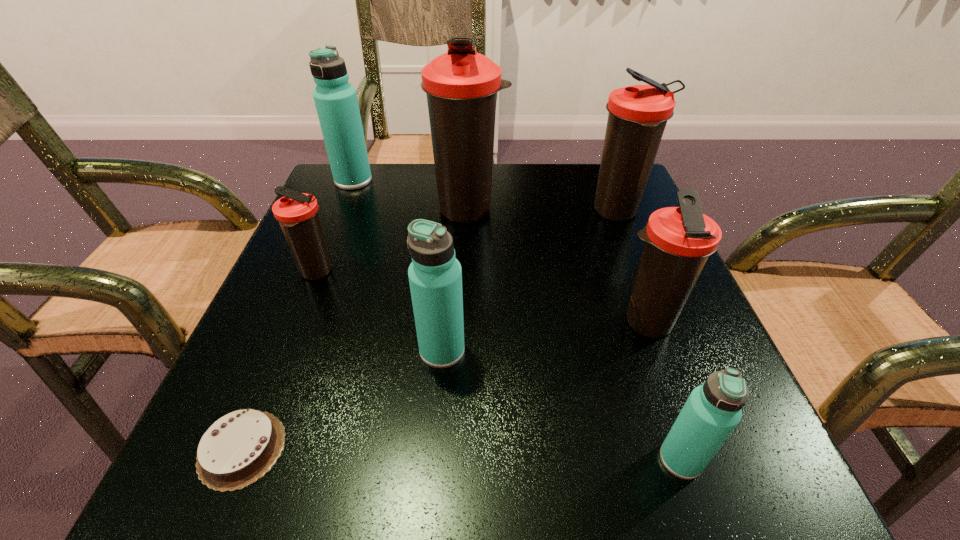
Where is `the nearest thermos bottle`? The height and width of the screenshot is (540, 960). the nearest thermos bottle is located at coordinates (713, 410).

The width and height of the screenshot is (960, 540). Find the location of `the nearest aqua thermos bottle`. the nearest aqua thermos bottle is located at coordinates (713, 410).

Locate an element on the screen. chocolate cake is located at coordinates (241, 447).

Identify the location of blank space located on the front of the biggest brown thermos bottle. The image size is (960, 540). 468,245.

This screenshot has width=960, height=540. Find the location of `free space located on the back of the third smallest brown thermos bottle`. free space located on the back of the third smallest brown thermos bottle is located at coordinates (602, 173).

Locate an element on the screen. The height and width of the screenshot is (540, 960). free location located on the front of the biggest aqua thermos bottle is located at coordinates (302, 309).

What are the coordinates of `blank space located 0.140m on the front of the nearest brown thermos bottle` in the screenshot? It's located at (684, 431).

I want to click on free space located 0.130m on the back of the second nearest aqua thermos bottle, so click(447, 279).

Image resolution: width=960 pixels, height=540 pixels. I want to click on vacant space located on the front of the leftmost brown thermos bottle, so click(x=250, y=440).

The image size is (960, 540). In order to click on vacant space situated on the right of the smallest aqua thermos bottle in this screenshot , I will do `click(748, 459)`.